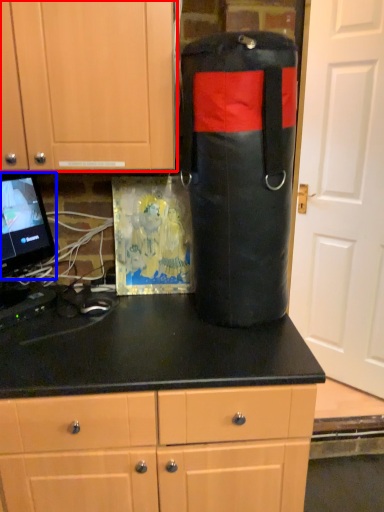
Question: Which of the following is the closest to the observer, cabinetry (highlighted by a red box) or computer monitor (highlighted by a blue box)?

Choices:
 (A) cabinetry
 (B) computer monitor

Answer: (A)